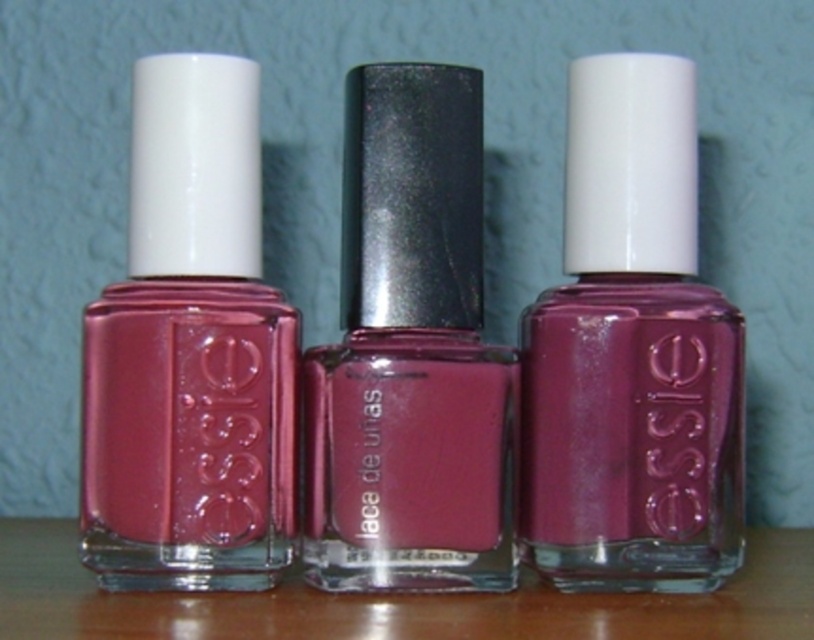
Question: Estimate the real-world distances between objects in this image. Which object is closer to the matte pink nail polish at left?

Choices:
 (A) matte purple nail polish at center
 (B) shiny metallic nail polish at center

Answer: (B)

Question: Can you confirm if matte purple nail polish at center is thinner than matte pink nail polish at left?

Choices:
 (A) yes
 (B) no

Answer: (B)

Question: Is matte purple nail polish at center in front of matte pink nail polish at left?

Choices:
 (A) yes
 (B) no

Answer: (B)

Question: Observing the image, what is the correct spatial positioning of matte purple nail polish at center in reference to shiny metallic nail polish at center?

Choices:
 (A) below
 (B) above

Answer: (B)

Question: Which point is farther to the camera?

Choices:
 (A) (418, 451)
 (B) (164, 116)
 (C) (600, 67)

Answer: (C)

Question: Which point is farther from the camera taking this photo?

Choices:
 (A) (664, 259)
 (B) (436, 72)
 (C) (138, 180)

Answer: (A)